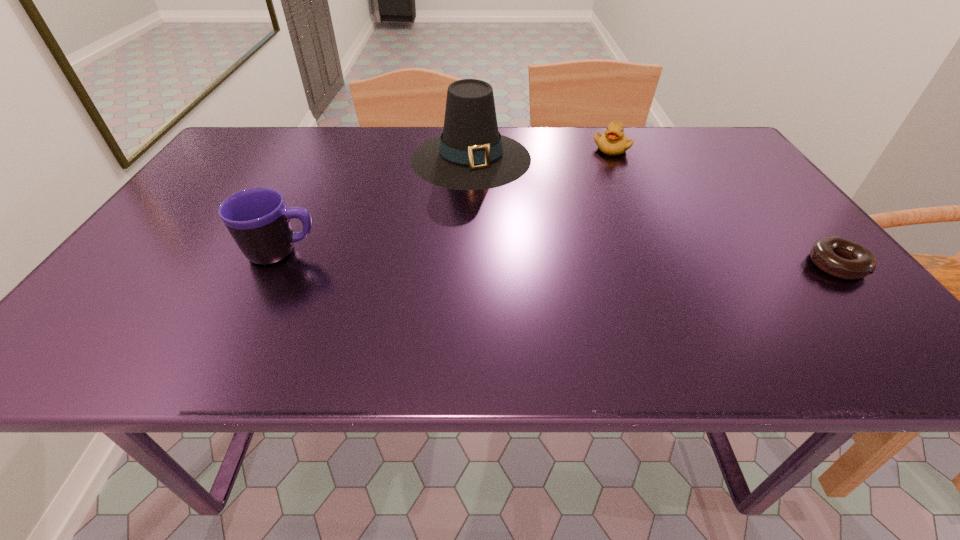
You are a GUI agent. You are given a task and a screenshot of the screen. Output one action in this format:
    pyautogui.click(x=<x>, y=<y>)
    Task: Click on the vacant space at the near edge of the desktop
    The image size is (960, 540).
    Given the screenshot: What is the action you would take?
    pyautogui.click(x=322, y=309)

This screenshot has height=540, width=960. In the image, there is a desktop. Identify the location of vacant region at the left edge. (255, 168).

Find the location of a particular element. This screenshot has width=960, height=540. free spot at the right edge of the desktop is located at coordinates (722, 173).

Image resolution: width=960 pixels, height=540 pixels. I want to click on vacant area at the near left corner of the desktop, so [x=182, y=297].

Locate an element on the screen. Image resolution: width=960 pixels, height=540 pixels. free space at the near right corner is located at coordinates (832, 291).

Where is `unoccupied area between the duckling and the tallest object`? Image resolution: width=960 pixels, height=540 pixels. unoccupied area between the duckling and the tallest object is located at coordinates (541, 153).

Find the location of a particular element. free space between the shortest object and the second shortest object is located at coordinates (724, 207).

You are a GUI agent. You are given a task and a screenshot of the screen. Output one action in this format:
    pyautogui.click(x=<x>, y=<y>)
    Task: Click on the free area in between the shortest object and the tallest object
    
    Given the screenshot: What is the action you would take?
    pyautogui.click(x=654, y=211)

Where is `vacant space in between the hat and the duckling`? vacant space in between the hat and the duckling is located at coordinates (541, 153).

Locate an element on the screen. This screenshot has width=960, height=540. unoccupied position between the tallest object and the mug is located at coordinates (377, 205).